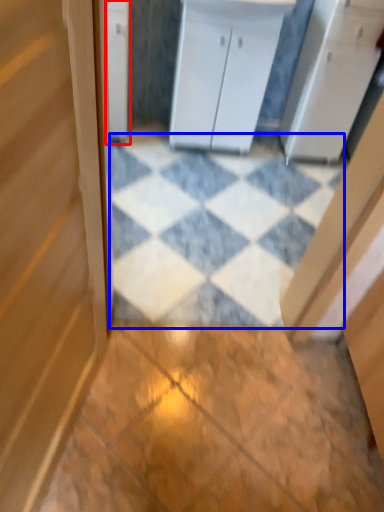
Question: Which point is closer to the camera, cabinetry (highlighted by a red box) or tile (highlighted by a blue box)?

Choices:
 (A) cabinetry
 (B) tile

Answer: (B)